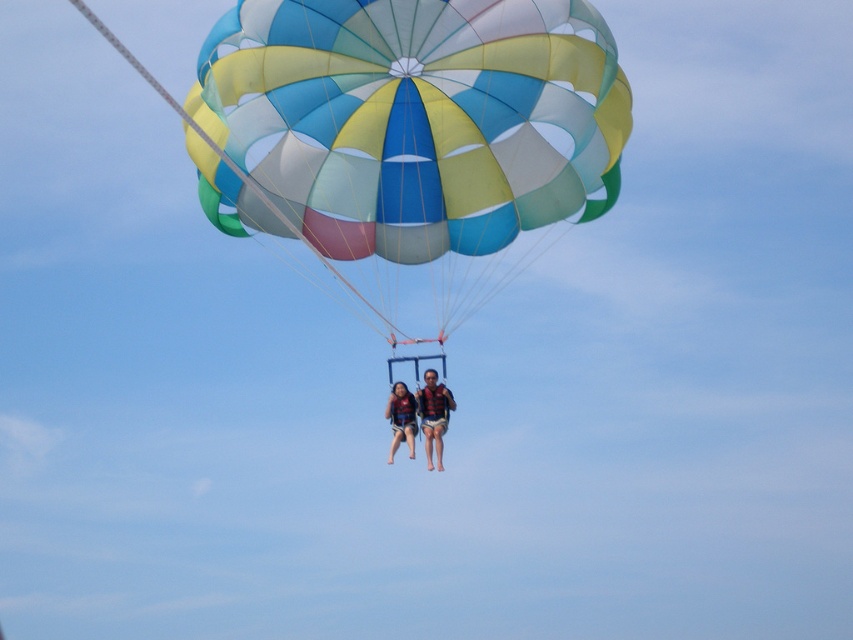
How distant is multicolored fabric parachute at center from matte blue life vest at center?

A distance of 100.03 feet exists between multicolored fabric parachute at center and matte blue life vest at center.

Who is positioned more to the right, multicolored fabric parachute at center or matte blue life vest at center?

From the viewer's perspective, multicolored fabric parachute at center appears more on the right side.

Describe the element at coordinates (419, 128) in the screenshot. I see `multicolored fabric parachute at center` at that location.

Locate an element on the screen. This screenshot has width=853, height=640. multicolored fabric parachute at center is located at coordinates (419, 128).

What do you see at coordinates (433, 413) in the screenshot? I see `matte black life vest at center` at bounding box center [433, 413].

Between matte black life vest at center and matte blue life vest at center, which one appears on the right side from the viewer's perspective?

From the viewer's perspective, matte black life vest at center appears more on the right side.

Does point (425, 426) come farther from viewer compared to point (415, 408)?

Yes.

Locate an element on the screen. This screenshot has height=640, width=853. matte black life vest at center is located at coordinates (433, 413).

Is multicolored fabric parachute at center below matte black life vest at center?

No.

Which of these two, multicolored fabric parachute at center or matte black life vest at center, stands shorter?

Standing shorter between the two is matte black life vest at center.

Identify the location of multicolored fabric parachute at center. The image size is (853, 640). (419, 128).